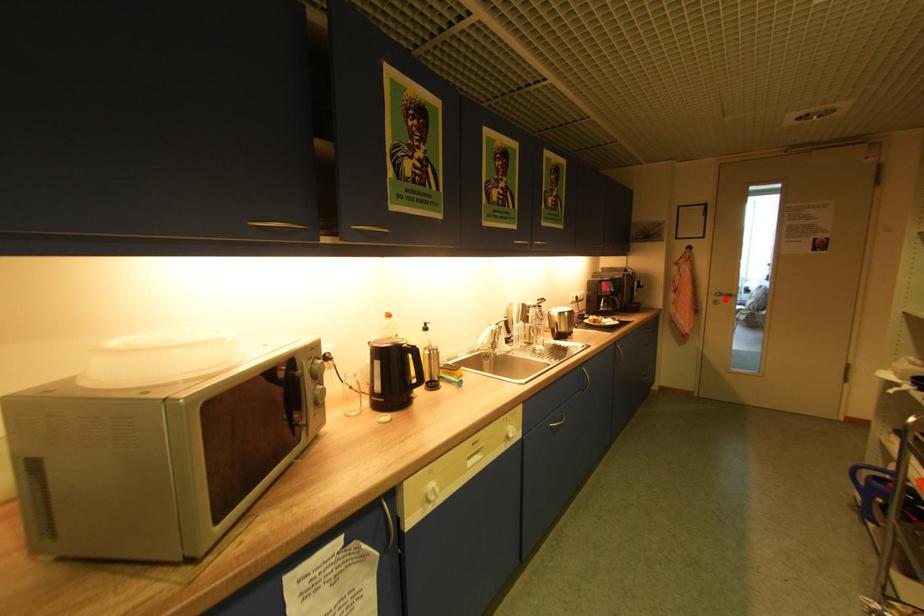
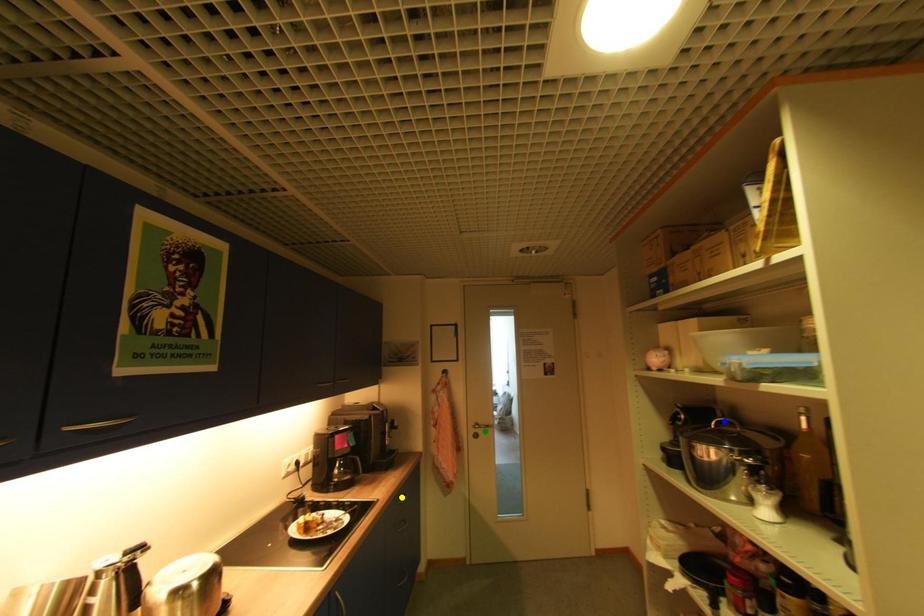
Question: I am providing you with two images of the same scene from different viewpoints. A red point is marked on the first image. You are given multiple points on the second image. Which mark in image 2 goes with the point in image 1?

Choices:
 (A) yellow point
 (B) green point
 (C) blue point

Answer: (B)